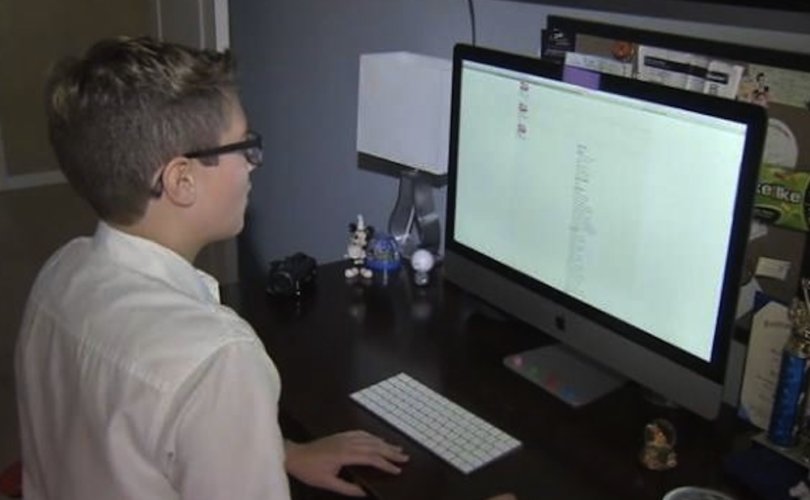
Find the location of a particular element. trophy is located at coordinates (786, 378).